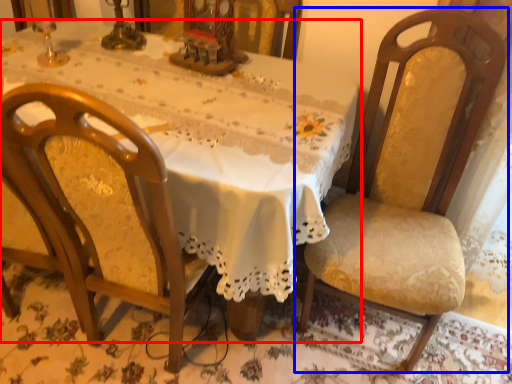
Question: Among these objects, which one is nearest to the camera, table (highlighted by a red box) or chair (highlighted by a blue box)?

Choices:
 (A) table
 (B) chair

Answer: (B)